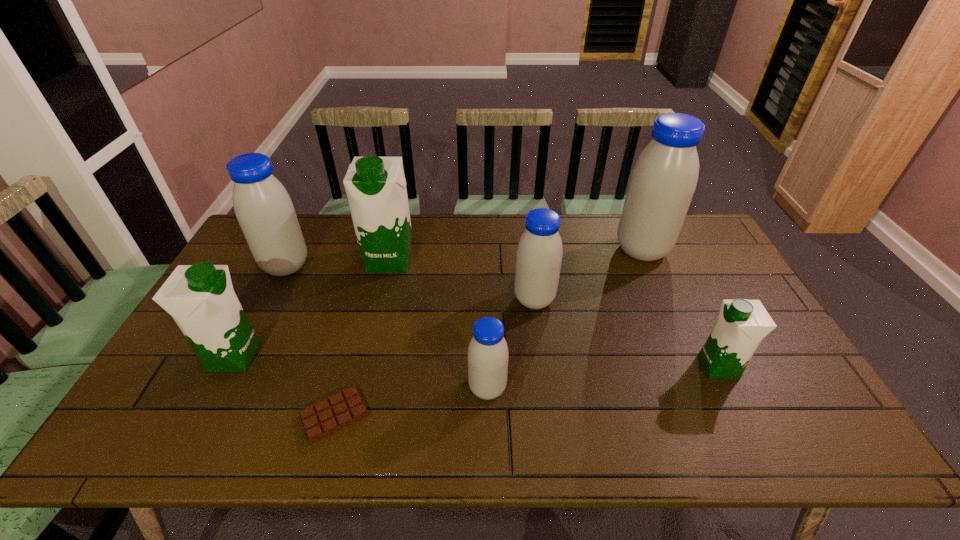
Image resolution: width=960 pixels, height=540 pixels. I want to click on the tallest object, so click(663, 181).

At what (x,y) coordinates should I click in order to perform the action: click on the rightmost blue soya milk. Please return your answer as a coordinate pair (x, y). The image size is (960, 540). Looking at the image, I should click on (663, 181).

The width and height of the screenshot is (960, 540). What are the coordinates of `the biggest green soya milk` in the screenshot? It's located at (375, 186).

Locate an element on the screen. the second green soya milk from left to right is located at coordinates (375, 186).

Find the location of `the leftmost blue soya milk`. the leftmost blue soya milk is located at coordinates (263, 207).

At what (x,y) coordinates should I click in order to perform the action: click on the second smallest blue soya milk. Please return your answer as a coordinate pair (x, y). Looking at the image, I should click on (539, 254).

This screenshot has height=540, width=960. What are the coordinates of `the fifth soya milk from left to right` in the screenshot? It's located at (539, 254).

Where is `the leftmost green soya milk`? This screenshot has width=960, height=540. the leftmost green soya milk is located at coordinates (200, 298).

Identify the location of the rightmost green soya milk. This screenshot has width=960, height=540. (742, 324).

At what (x,y) coordinates should I click in order to perform the action: click on the fifth object from left to right. Please return your answer as a coordinate pair (x, y). Looking at the image, I should click on (488, 355).